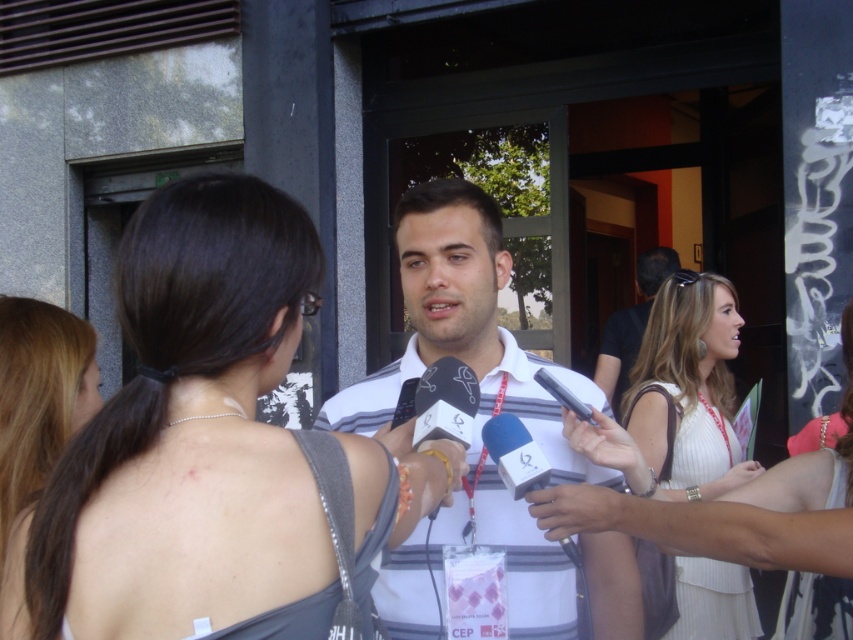
Is point (699, 400) positioned in front of point (637, 275)?

Yes, it is in front of point (637, 275).

Who is lower down, white knit dress at center or black striped shirt at center?

white knit dress at center

Is point (680, 579) farther from viewer compared to point (639, 276)?

No, (680, 579) is closer to viewer.

The width and height of the screenshot is (853, 640). Find the location of `white knit dress at center`. white knit dress at center is located at coordinates (688, 388).

In the scene shown: Does smooth gray dress at center appear on the right side of white striped shirt at center?

No, smooth gray dress at center is not to the right of white striped shirt at center.

The image size is (853, 640). I want to click on smooth gray dress at center, so click(184, 436).

In order to click on smooth gray dress at center in this screenshot , I will do `click(184, 436)`.

Which is more to the left, white textured dress at center or white knit dress at center?

white textured dress at center

Which is in front, point (844, 312) or point (676, 296)?

Point (844, 312) is more forward.

Locate an element on the screen. white textured dress at center is located at coordinates (726, 520).